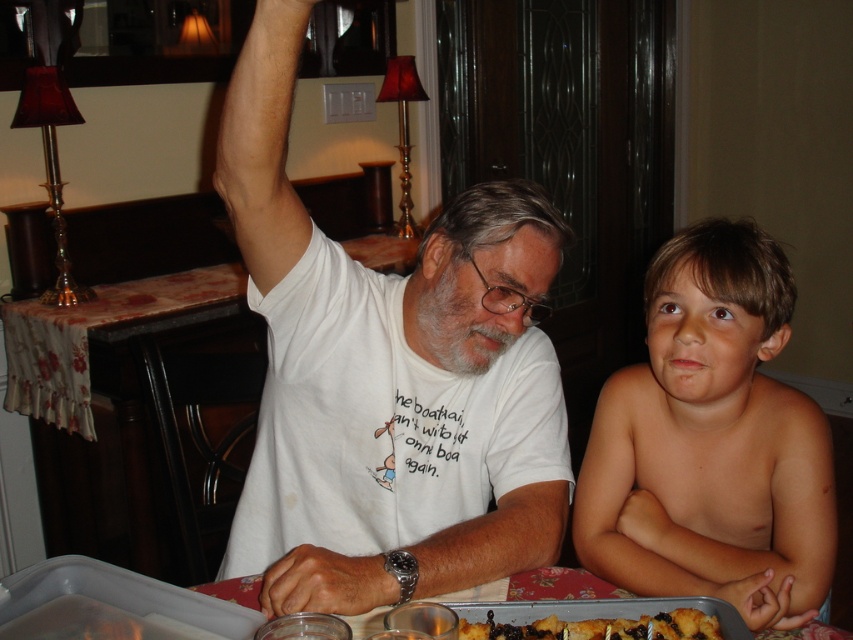
What is the relationship between the width of the smooth skin boy at right and the golden brown cake at lower center?

The smooth skin boy at right is wider than the golden brown cake at lower center according to the description.